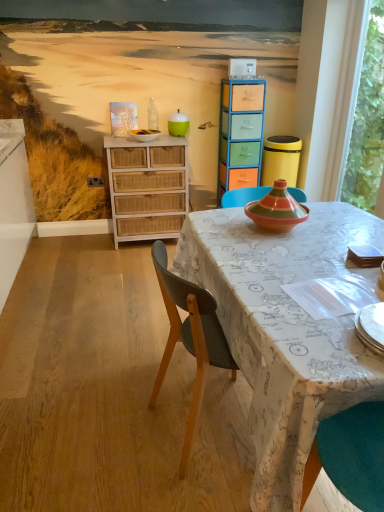
Question: Is translucent glass bottle at center next to map-patterned fabric at center?

Choices:
 (A) no
 (B) yes

Answer: (A)

Question: Would you say translucent glass bottle at center is a long distance from map-patterned fabric at center?

Choices:
 (A) no
 (B) yes

Answer: (B)

Question: Does translucent glass bottle at center have a smaller size compared to map-patterned fabric at center?

Choices:
 (A) yes
 (B) no

Answer: (A)

Question: Is map-patterned fabric at center inside translucent glass bottle at center?

Choices:
 (A) yes
 (B) no

Answer: (B)

Question: Is translucent glass bottle at center to the left of map-patterned fabric at center from the viewer's perspective?

Choices:
 (A) yes
 (B) no

Answer: (A)

Question: Is white plastic corded phone at upper center to the left or to the right of white glossy bowl at upper center in the image?

Choices:
 (A) right
 (B) left

Answer: (A)

Question: From the image's perspective, is white plastic corded phone at upper center above or below white glossy bowl at upper center?

Choices:
 (A) above
 (B) below

Answer: (A)

Question: Is point (238, 74) positioned closer to the camera than point (135, 131)?

Choices:
 (A) farther
 (B) closer

Answer: (B)

Question: From a real-world perspective, is white plastic corded phone at upper center positioned above or below white glossy bowl at upper center?

Choices:
 (A) above
 (B) below

Answer: (A)

Question: Is point (354, 122) closer or farther from the camera than point (157, 131)?

Choices:
 (A) closer
 (B) farther

Answer: (A)

Question: From a real-world perspective, is transparent glass window at right positioned above or below white glossy bowl at upper center?

Choices:
 (A) below
 (B) above

Answer: (B)

Question: In terms of height, does transparent glass window at right look taller or shorter compared to white glossy bowl at upper center?

Choices:
 (A) tall
 (B) short

Answer: (A)

Question: Relative to white glossy bowl at upper center, is transparent glass window at right in front or behind?

Choices:
 (A) behind
 (B) front

Answer: (B)

Question: Considering the positions of white glossy bowl at upper center and white wicker dresser at left in the image, is white glossy bowl at upper center wider or thinner than white wicker dresser at left?

Choices:
 (A) wide
 (B) thin

Answer: (B)

Question: Considering the positions of white glossy bowl at upper center and white wicker dresser at left in the image, is white glossy bowl at upper center taller or shorter than white wicker dresser at left?

Choices:
 (A) short
 (B) tall

Answer: (A)